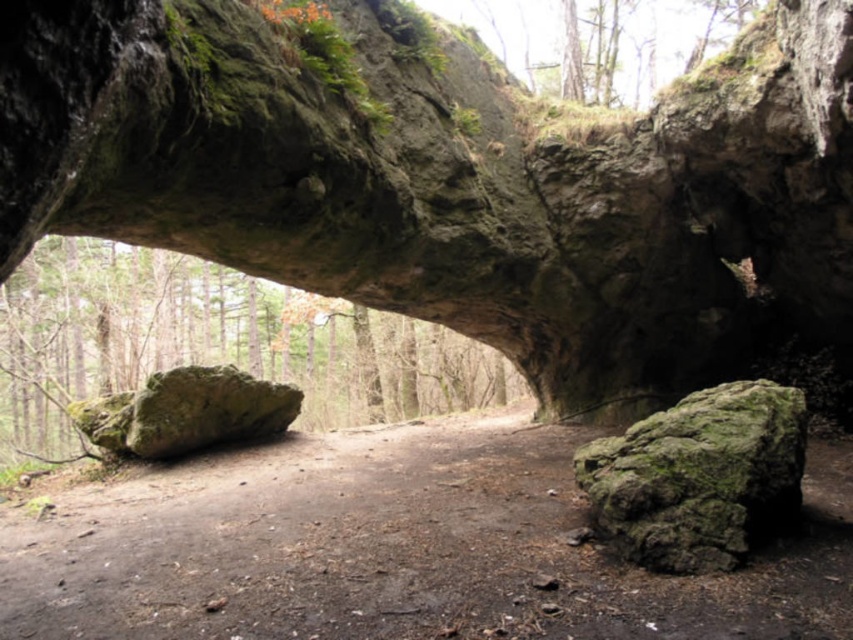
Can you confirm if dull brown dirt at center is smaller than green mossy rock at left?

Yes.

Which is below, dull brown dirt at center or green mossy rock at left?

Positioned lower is dull brown dirt at center.

What do you see at coordinates (397, 548) in the screenshot? I see `dull brown dirt at center` at bounding box center [397, 548].

Locate an element on the screen. dull brown dirt at center is located at coordinates (397, 548).

This screenshot has height=640, width=853. What do you see at coordinates (698, 476) in the screenshot?
I see `green mossy rock at lower right` at bounding box center [698, 476].

From the picture: Does green mossy rock at lower right appear under green mossy rock at left?

No.

The image size is (853, 640). Identify the location of green mossy rock at lower right. (698, 476).

Where is `dull brown dirt at center`? Image resolution: width=853 pixels, height=640 pixels. dull brown dirt at center is located at coordinates (397, 548).

Which is more to the left, dull brown dirt at center or green mossy rock at lower right?

green mossy rock at lower right is more to the left.

The image size is (853, 640). Identify the location of dull brown dirt at center. (397, 548).